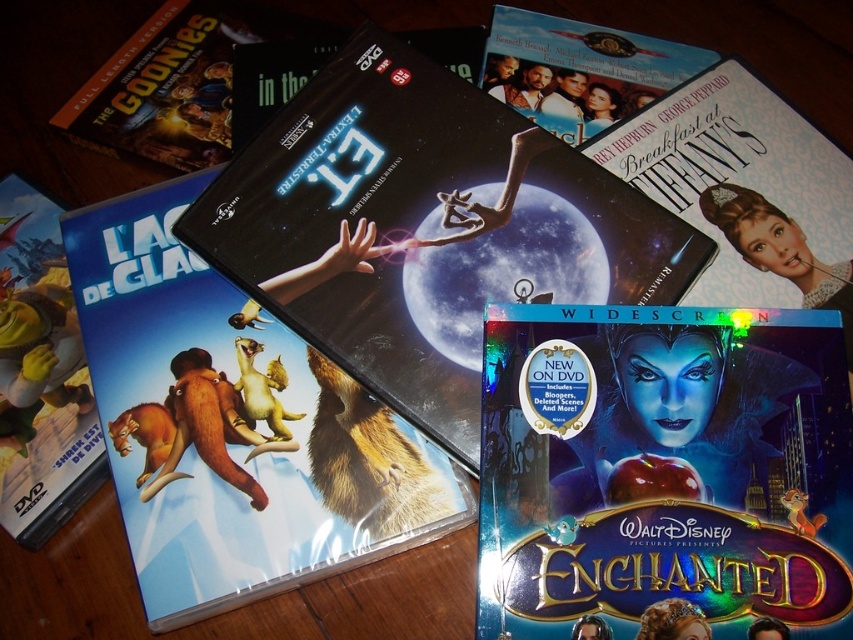
Does black glossy dvd case at center appear under matte black book at upper center?

Yes, black glossy dvd case at center is below matte black book at upper center.

This screenshot has width=853, height=640. Find the location of `black glossy dvd case at center`. black glossy dvd case at center is located at coordinates 233,426.

Find the location of a particular element. black glossy dvd case at center is located at coordinates (233, 426).

Who is shorter, blue glossy dvd case at lower left or matte black book at upper center?

matte black book at upper center

Locate an element on the screen. blue glossy dvd case at lower left is located at coordinates (39, 374).

In the scene shown: Does blue glossy dvd case at center appear on the right side of black glossy dvd case at center?

Indeed, blue glossy dvd case at center is positioned on the right side of black glossy dvd case at center.

Which is in front, point (822, 484) or point (230, 419)?

Positioned in front is point (822, 484).

Does point (811, 561) come in front of point (276, 525)?

That is True.

You are a GUI agent. You are given a task and a screenshot of the screen. Output one action in this format:
    pyautogui.click(x=<x>, y=<y>)
    Task: Click on the blue glossy dvd case at center
    This screenshot has width=853, height=640.
    Given the screenshot: What is the action you would take?
    pyautogui.click(x=664, y=474)